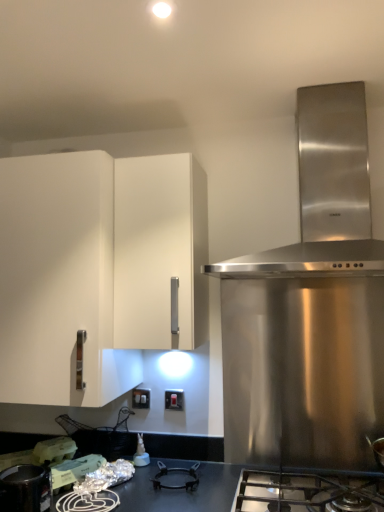
Question: Is shiny metallic pot at lower left completely or partially inside white matte plastic container at lower left?

Choices:
 (A) yes
 (B) no

Answer: (B)

Question: Is white matte plastic container at lower left taller than shiny metallic pot at lower left?

Choices:
 (A) no
 (B) yes

Answer: (A)

Question: Is white matte plastic container at lower left in contact with shiny metallic pot at lower left?

Choices:
 (A) yes
 (B) no

Answer: (B)

Question: From the image's perspective, is white matte plastic container at lower left on shiny metallic pot at lower left?

Choices:
 (A) no
 (B) yes

Answer: (A)

Question: From a real-world perspective, is white matte plastic container at lower left on top of shiny metallic pot at lower left?

Choices:
 (A) no
 (B) yes

Answer: (B)

Question: From a real-world perspective, is white matte plastic container at lower left positioned under shiny metallic pot at lower left based on gravity?

Choices:
 (A) yes
 (B) no

Answer: (B)

Question: From a real-world perspective, is white plastic electric outlet at lower center, the 2th electric outlet from the right, located higher than white matte cabinet at left?

Choices:
 (A) no
 (B) yes

Answer: (A)

Question: Considering the relative sizes of white plastic electric outlet at lower center, which ranks as the 1th electric outlet in left-to-right order, and white matte cabinet at left in the image provided, is white plastic electric outlet at lower center, which ranks as the 1th electric outlet in left-to-right order, smaller than white matte cabinet at left?

Choices:
 (A) yes
 (B) no

Answer: (A)

Question: Could you tell me if white plastic electric outlet at lower center, which ranks as the 1th electric outlet in left-to-right order, is turned towards white matte cabinet at left?

Choices:
 (A) no
 (B) yes

Answer: (A)

Question: From a real-world perspective, is white plastic electric outlet at lower center, which ranks as the 1th electric outlet in left-to-right order, located beneath white matte cabinet at left?

Choices:
 (A) no
 (B) yes

Answer: (B)

Question: Is white plastic electric outlet at lower center, which ranks as the 1th electric outlet in left-to-right order, not inside white matte cabinet at left?

Choices:
 (A) no
 (B) yes

Answer: (B)

Question: Can you confirm if white plastic electric outlet at lower center, which ranks as the 1th electric outlet in left-to-right order, is thinner than white matte cabinet at left?

Choices:
 (A) yes
 (B) no

Answer: (A)

Question: From the image's perspective, does white matte plastic container at lower left appear lower than stainless steel gas stove at lower center?

Choices:
 (A) no
 (B) yes

Answer: (A)